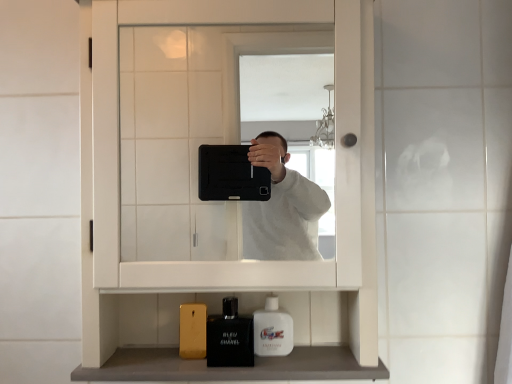
Find the location of a particular element. The image size is (512, 384). blank space to the left of white glossy mouthwash at lower center is located at coordinates (196, 347).